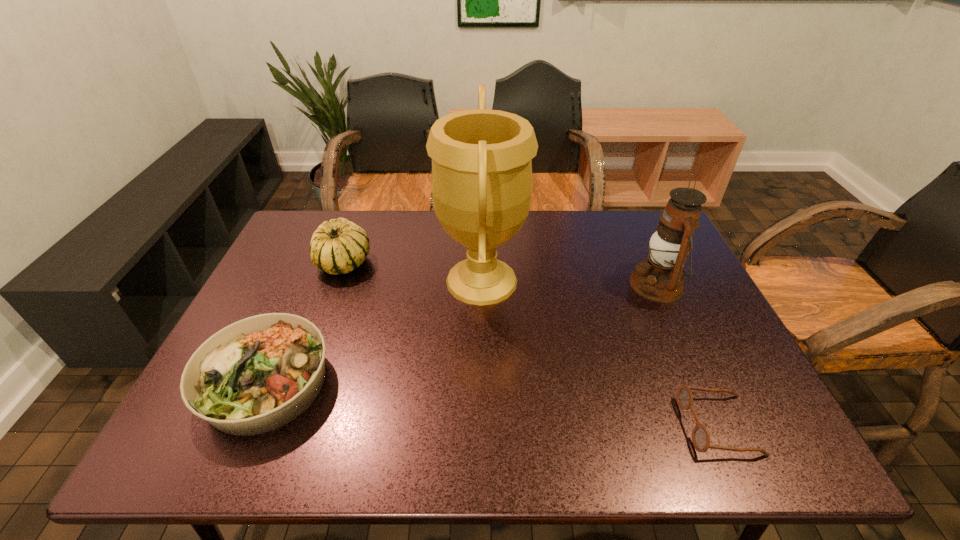
This screenshot has height=540, width=960. I want to click on free space between the lantern and the third object from left to right, so click(569, 282).

The width and height of the screenshot is (960, 540). What are the coordinates of `free spot between the spectacles and the lantern` in the screenshot? It's located at (687, 355).

What are the coordinates of `object that stands as the fourth closest to the gourd` in the screenshot? It's located at (700, 436).

Where is `the closest object relative to the second tallest object`? The image size is (960, 540). the closest object relative to the second tallest object is located at coordinates (700, 436).

The height and width of the screenshot is (540, 960). I want to click on free location that satisfies the following two spatial constraints: 1. on the side of the lantern, there is a wick adjustment knob; 2. on the front side of the second shortest object, so click(701, 383).